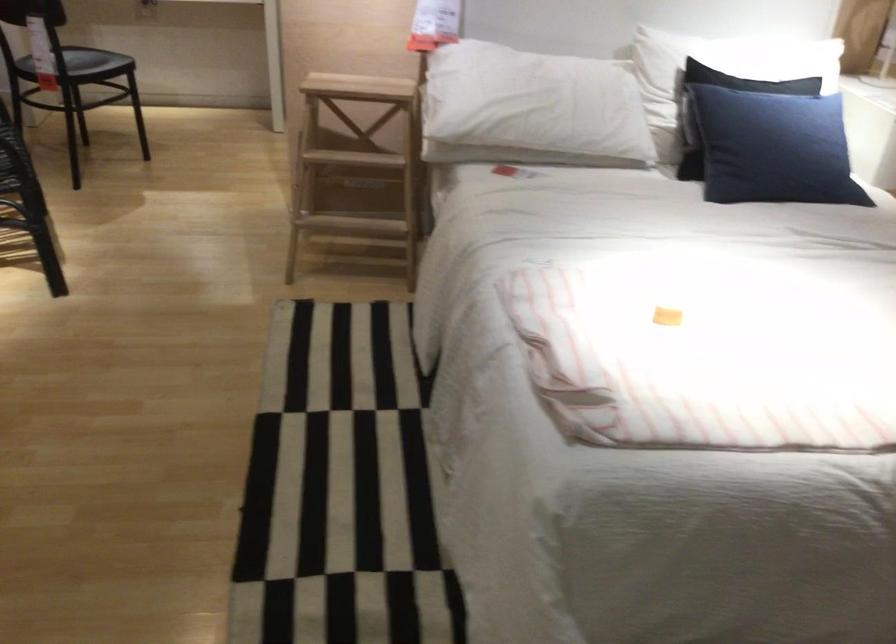
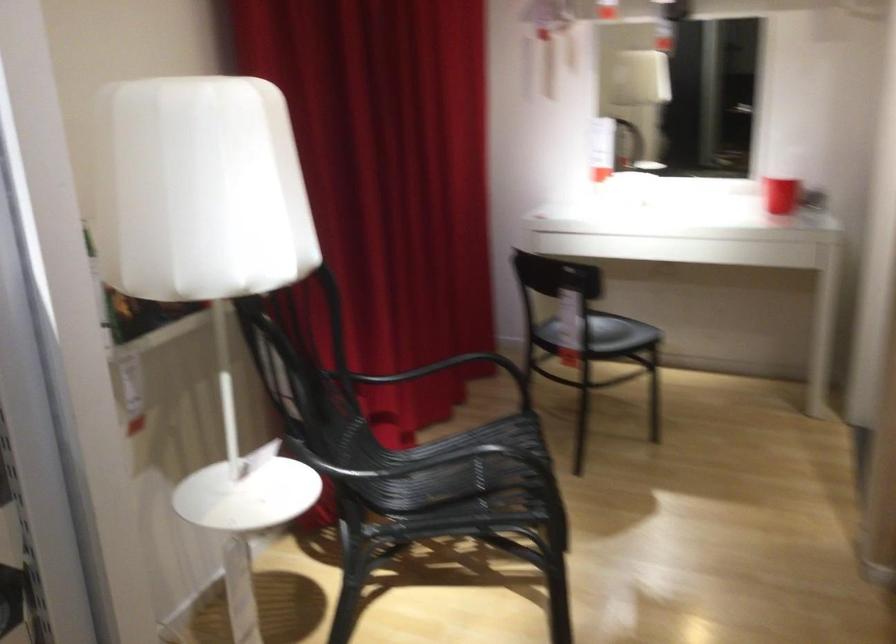
Question: The camera is either moving clockwise (left) or counter-clockwise (right) around the object. The first image is from the beginning of the video and the second image is from the end. Is the camera moving left or right when shooting the video?

Choices:
 (A) Left
 (B) Right

Answer: (B)